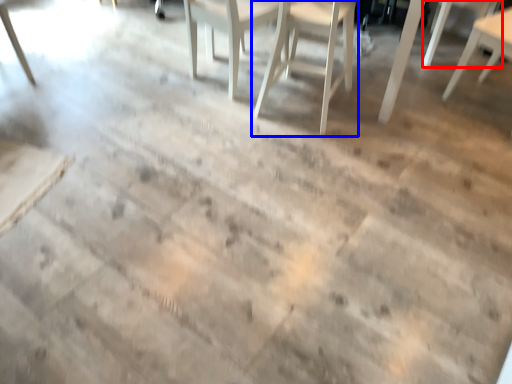
Question: Which of the following is the farthest to the observer, chair (highlighted by a red box) or chair (highlighted by a blue box)?

Choices:
 (A) chair
 (B) chair

Answer: (A)